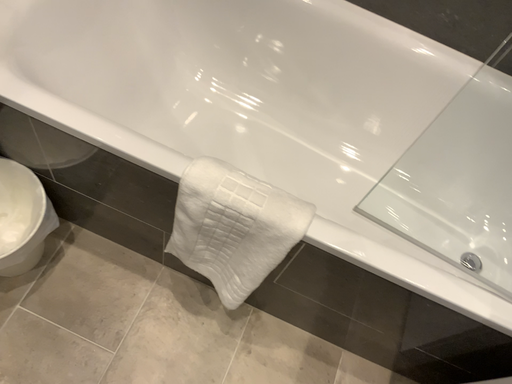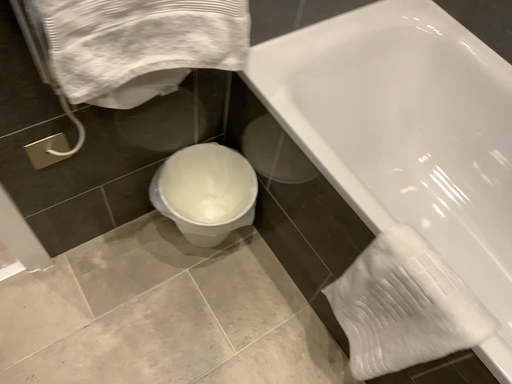
Question: Which way did the camera rotate in the video?

Choices:
 (A) rotated downward
 (B) rotated upward

Answer: (B)